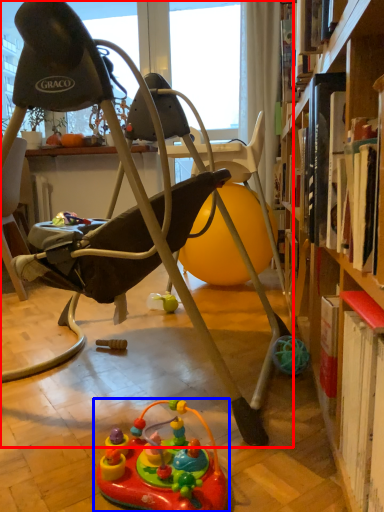
Question: Which object is closer to the camera taking this photo, chair (highlighted by a red box) or toy (highlighted by a blue box)?

Choices:
 (A) chair
 (B) toy

Answer: (B)